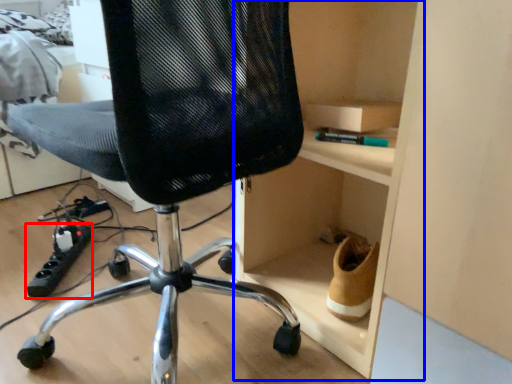
Question: Among these objects, which one is farthest to the camera, equipment (highlighted by a red box) or cabinet (highlighted by a blue box)?

Choices:
 (A) equipment
 (B) cabinet

Answer: (A)